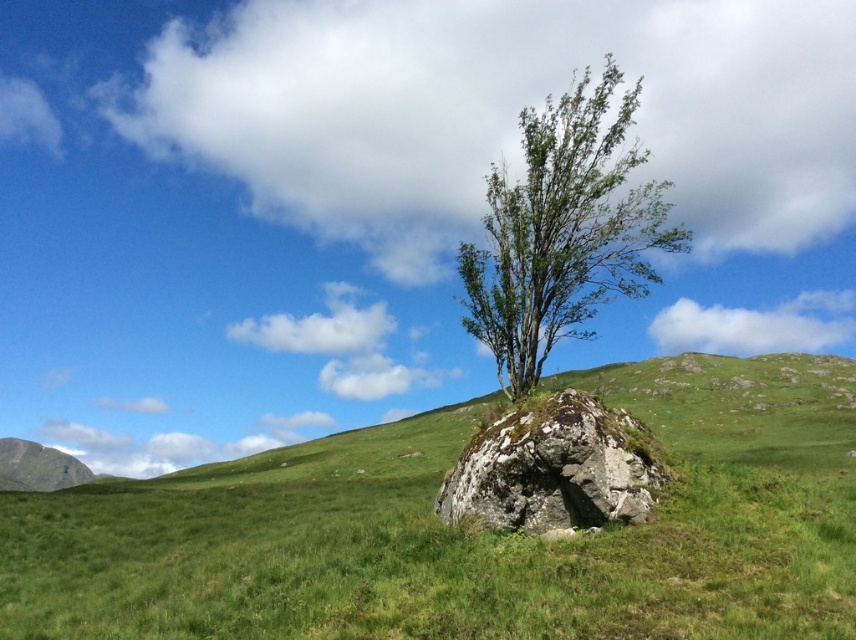
Does green grass at center appear over mossy rock at center?

Incorrect, green grass at center is not positioned above mossy rock at center.

Which is behind, point (217, 572) or point (649, 435)?

Point (649, 435)

Locate an element on the screen. green grass at center is located at coordinates (468, 529).

Is green grass at center further to the viewer compared to green leafy tree at center?

No, green grass at center is closer to the viewer.

Is green grass at center positioned in front of green leafy tree at center?

Yes, it is.

Who is more distant from viewer, (402,515) or (539,225)?

The point (539,225) is more distant.

You are a GUI agent. You are given a task and a screenshot of the screen. Output one action in this format:
    pyautogui.click(x=<x>, y=<y>)
    Task: Click on the green grass at center
    Image resolution: width=856 pixels, height=640 pixels.
    Given the screenshot: What is the action you would take?
    pyautogui.click(x=468, y=529)

Between green leafy tree at center and mossy rock at center, which one has more height?

green leafy tree at center is taller.

Does green leafy tree at center have a lesser width compared to mossy rock at center?

No, green leafy tree at center is not thinner than mossy rock at center.

Find the location of a particular element. The height and width of the screenshot is (640, 856). green leafy tree at center is located at coordinates (563, 230).